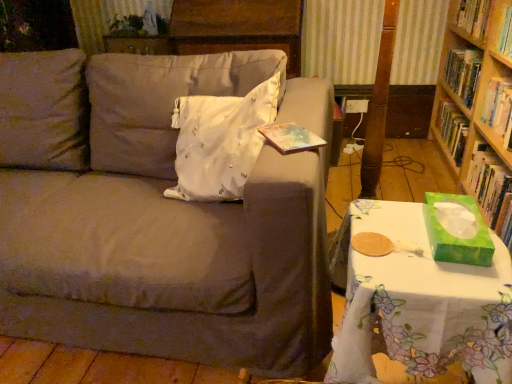
Question: From a real-world perspective, is white satin pillow at center above or below hardcover book at upper right, the 2th book when ordered from top to bottom?

Choices:
 (A) below
 (B) above

Answer: (B)

Question: Is white satin pillow at center taller or shorter than hardcover book at upper right, the 2th book positioned from the bottom?

Choices:
 (A) short
 (B) tall

Answer: (B)

Question: Considering the real-world distances, which object is closest to the white floral tablecloth at lower right?

Choices:
 (A) white satin pillow at center
 (B) hardcover book at upper right, the 2th book when ordered from top to bottom
 (C) hardcover book at upper right, which is the 3th book in bottom-to-top order
 (D) matte gray couch at center
 (E) green matte tissue box at right, placed as the first book when sorted from bottom to top

Answer: (D)

Question: Estimate the real-world distances between objects in this image. Which object is farther from the white satin pillow at center?

Choices:
 (A) hardcover book at upper right, the 2th book positioned from the bottom
 (B) hardcover book at upper right, which is the 3th book in bottom-to-top order
 (C) white floral tablecloth at lower right
 (D) matte gray couch at center
 (E) green cardboard bookcase at right

Answer: (B)